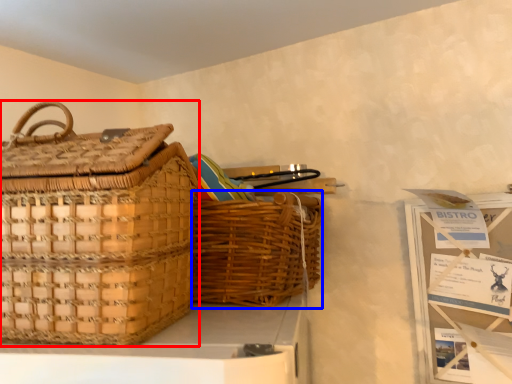
Question: Which of the following is the farthest to the observer, picnic basket (highlighted by a red box) or picnic basket (highlighted by a blue box)?

Choices:
 (A) picnic basket
 (B) picnic basket

Answer: (B)